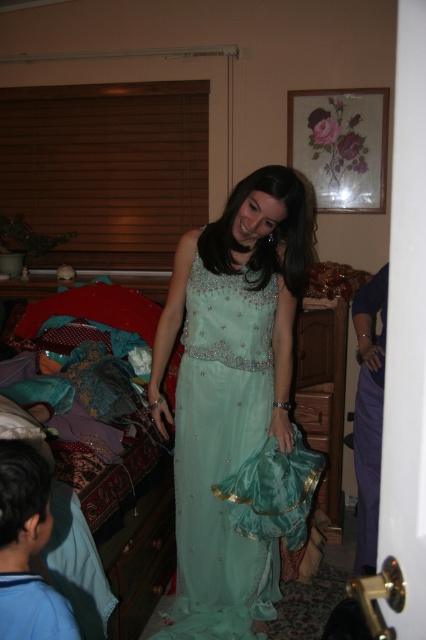
Question: Does satin teal dress at center appear on the right side of teal satin gown at center?

Choices:
 (A) no
 (B) yes

Answer: (A)

Question: Which object is farther from the camera taking this photo?

Choices:
 (A) satin teal dress at center
 (B) teal satin gown at center

Answer: (B)

Question: Is satin teal dress at center thinner than teal satin gown at center?

Choices:
 (A) yes
 (B) no

Answer: (B)

Question: Which of the following is the farthest from the observer?

Choices:
 (A) (377, 289)
 (B) (279, 477)

Answer: (A)

Question: Which point is farther to the camera?

Choices:
 (A) (365, 445)
 (B) (201, 616)

Answer: (A)

Question: Does satin teal dress at center have a smaller size compared to teal satin gown at center?

Choices:
 (A) no
 (B) yes

Answer: (A)